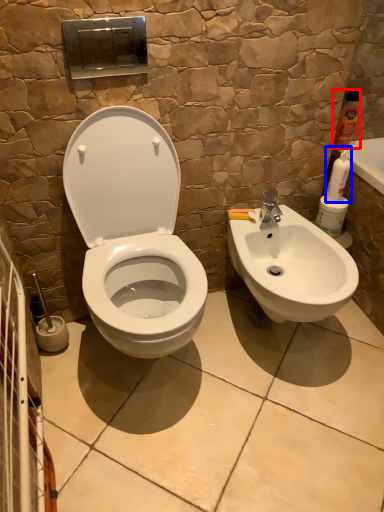
Question: Which object is closer to the camera taking this photo, cleaning product (highlighted by a red box) or cleaning product (highlighted by a blue box)?

Choices:
 (A) cleaning product
 (B) cleaning product

Answer: (B)